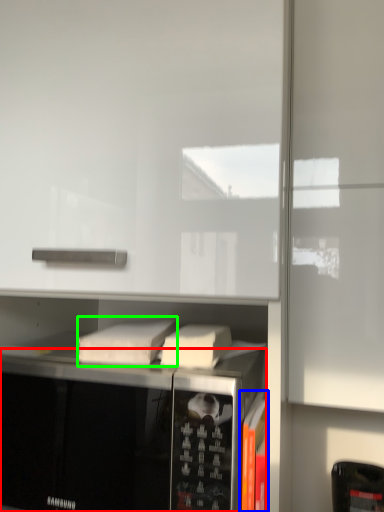
Question: Estimate the real-world distances between objects in this image. Which object is farther from microwave oven (highlighted by a red box), book (highlighted by a blue box) or book (highlighted by a green box)?

Choices:
 (A) book
 (B) book

Answer: (A)